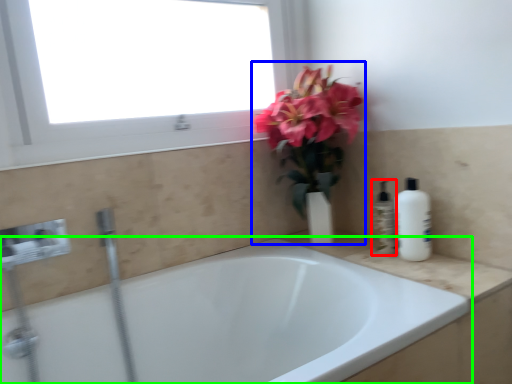
Question: Which object is the farthest from toiletry (highlighted by a red box)? Choose among these: floral arrangement (highlighted by a blue box) or bathtub (highlighted by a green box).

Choices:
 (A) floral arrangement
 (B) bathtub

Answer: (B)